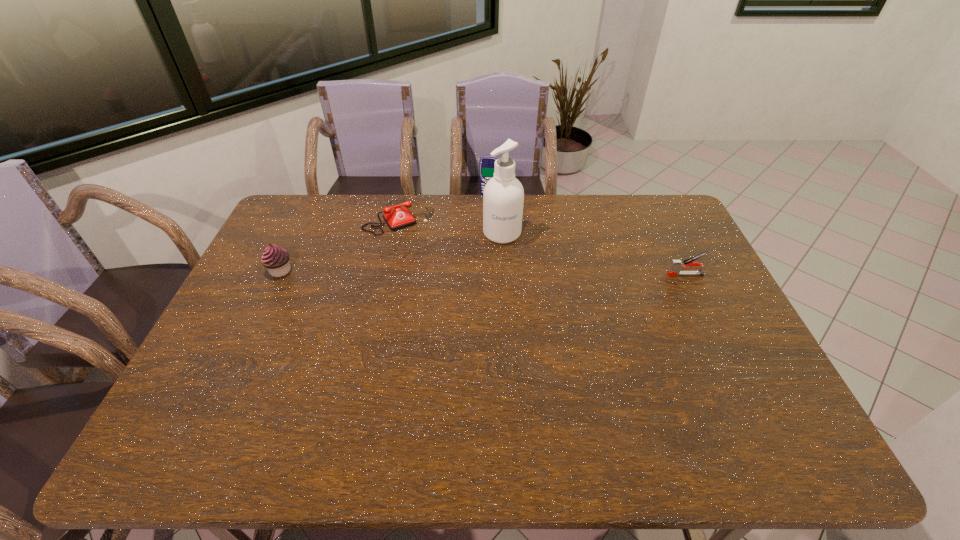
At what (x,y) coordinates should I click in order to perform the action: click on the third shortest object. Please return your answer as a coordinate pair (x, y). The height and width of the screenshot is (540, 960). Looking at the image, I should click on (276, 259).

Find the location of a particular element. cupcake is located at coordinates (276, 259).

Identify the location of the second shortest object. (676, 265).

Image resolution: width=960 pixels, height=540 pixels. What are the coordinates of `the rightmost object` in the screenshot? It's located at (676, 265).

Locate an element on the screen. The image size is (960, 540). telephone is located at coordinates [x=398, y=218].

Locate an element on the screen. The height and width of the screenshot is (540, 960). the second object from left to right is located at coordinates (398, 218).

The image size is (960, 540). Identify the location of cleansing agent. (503, 197).

The height and width of the screenshot is (540, 960). I want to click on the farthest object, so click(486, 166).

Locate an element on the screen. The image size is (960, 540). cellular telephone is located at coordinates (486, 166).

Find the location of a particular element. vacant space located 0.320m on the right of the third shortest object is located at coordinates (394, 271).